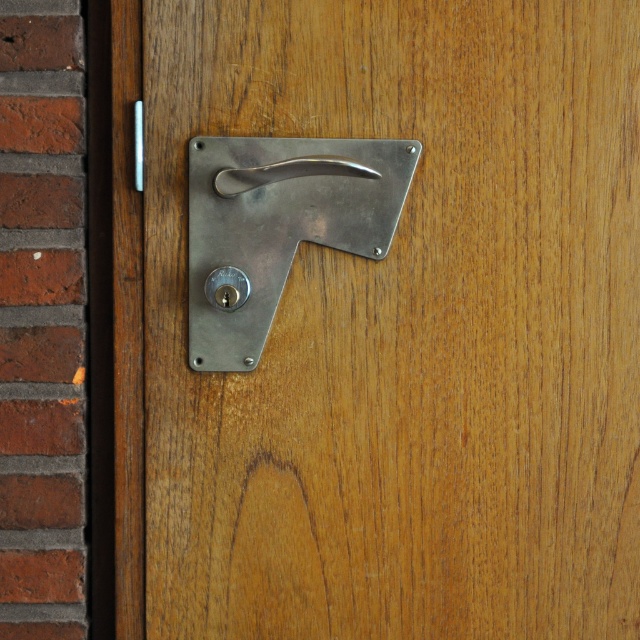
Question: Among these objects, which one is farthest from the camera?

Choices:
 (A) polished metal latch at upper center
 (B) polished silver handle at upper center

Answer: (A)

Question: Can you confirm if polished metal door handle at center is bigger than polished metal latch at upper center?

Choices:
 (A) yes
 (B) no

Answer: (A)

Question: Which is nearer to the polished metal door handle at center?

Choices:
 (A) polished metal latch at upper center
 (B) polished silver handle at upper center

Answer: (B)

Question: Does polished metal door handle at center lie in front of polished silver handle at upper center?

Choices:
 (A) no
 (B) yes

Answer: (A)

Question: Based on their relative distances, which object is nearer to the polished silver handle at upper center?

Choices:
 (A) polished metal latch at upper center
 (B) polished metal door handle at center

Answer: (B)

Question: Is polished metal door handle at center to the left of polished metal latch at upper center from the viewer's perspective?

Choices:
 (A) no
 (B) yes

Answer: (A)